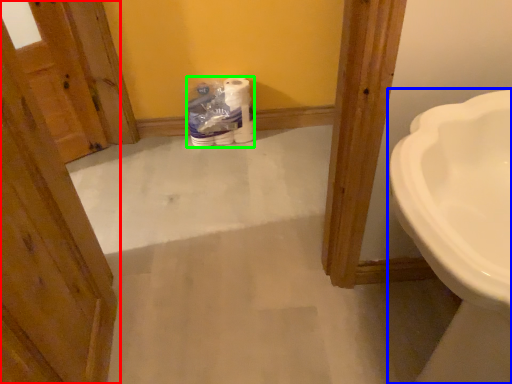
Question: Considering the real-world distances, which object is closest to door (highlighted by a red box)? sink (highlighted by a blue box) or toilet paper (highlighted by a green box).

Choices:
 (A) sink
 (B) toilet paper

Answer: (A)